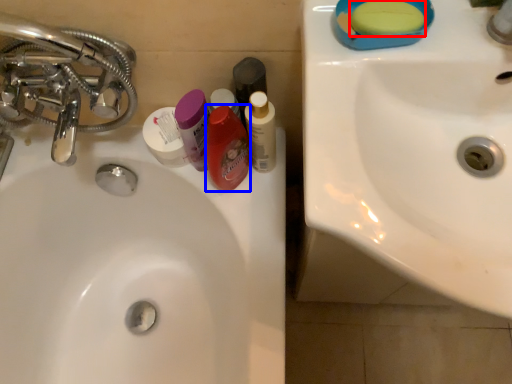
Question: Among these objects, which one is nearest to the camera, soap (highlighted by a red box) or mouthwash (highlighted by a blue box)?

Choices:
 (A) soap
 (B) mouthwash

Answer: (A)